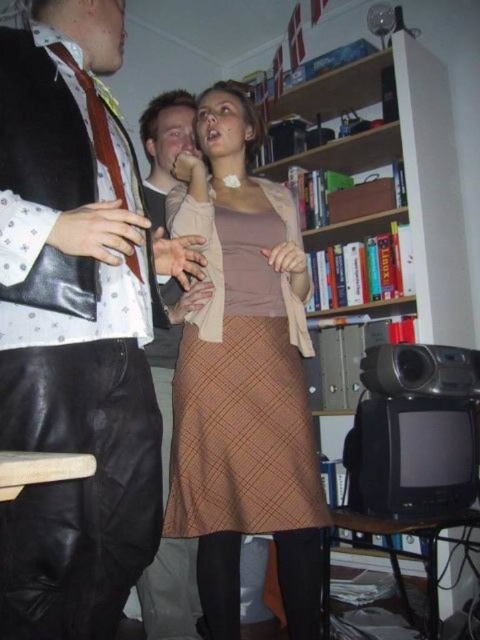
In the scene shown: You are standing in the living room and want to place a new book on the wooden bookshelf at center. According to the coordinates provided, where exactly should you place the book?

The wooden bookshelf at center is located at coordinates point (405, 177), so place the book there.

You are a photographer setting up a shoot in the living room. You need to position a spotlight so that it illuminates both the brown plaid skirt at center and the matte black tie at center without casting shadows on the background wall. Based on their positions, which object should be closer to the spotlight to achieve this?

The brown plaid skirt at center is in front of the matte black tie at center, so positioning the spotlight closer to the brown plaid skirt at center will ensure both are illuminated without casting shadows on the background wall.